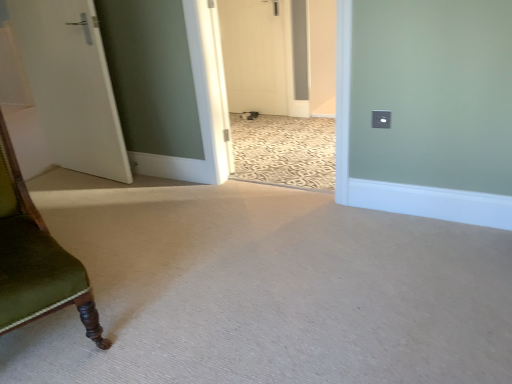
Question: Which direction should I rotate to look at white matte door at center, the 1th door from the right?

Choices:
 (A) left
 (B) right

Answer: (A)

Question: Is green velvet chair at left smaller than white matte door at left, which appears as the 1th door when viewed from the left?

Choices:
 (A) no
 (B) yes

Answer: (A)

Question: From a real-world perspective, does green velvet chair at left stand above white matte door at left, which is the second door from back to front?

Choices:
 (A) yes
 (B) no

Answer: (B)

Question: Considering the relative sizes of green velvet chair at left and white matte door at left, which is counted as the 1th door, starting from the front, in the image provided, is green velvet chair at left shorter than white matte door at left, which is counted as the 1th door, starting from the front,?

Choices:
 (A) yes
 (B) no

Answer: (A)

Question: Can you confirm if green velvet chair at left is positioned to the right of white matte door at left, which appears as the 1th door when viewed from the left?

Choices:
 (A) no
 (B) yes

Answer: (B)

Question: From the image's perspective, does green velvet chair at left appear lower than white matte door at left, which appears as the 1th door when viewed from the left?

Choices:
 (A) yes
 (B) no

Answer: (A)

Question: Considering the relative sizes of green velvet chair at left and white matte door at left, the second door viewed from the right, in the image provided, is green velvet chair at left wider than white matte door at left, the second door viewed from the right,?

Choices:
 (A) no
 (B) yes

Answer: (B)

Question: Is green velvet chair at left oriented towards white matte door at center, which ranks as the first door in back-to-front order?

Choices:
 (A) no
 (B) yes

Answer: (A)

Question: From the image's perspective, does green velvet chair at left appear lower than white matte door at center, the second door when ordered from front to back?

Choices:
 (A) no
 (B) yes

Answer: (B)

Question: Is white matte door at center, the 1th door from the right, completely or partially inside green velvet chair at left?

Choices:
 (A) no
 (B) yes

Answer: (A)

Question: Is green velvet chair at left taller than white matte door at center, which is the second door from left to right?

Choices:
 (A) no
 (B) yes

Answer: (A)

Question: Are green velvet chair at left and white matte door at center, the second door when ordered from front to back, beside each other?

Choices:
 (A) yes
 (B) no

Answer: (B)

Question: Is green velvet chair at left completely or partially outside of white matte door at center, the second door when ordered from front to back?

Choices:
 (A) no
 (B) yes

Answer: (B)

Question: Considering the relative sizes of white matte door at left, which appears as the 1th door when viewed from the left, and white matte door at center, which is the second door from left to right, in the image provided, is white matte door at left, which appears as the 1th door when viewed from the left, wider than white matte door at center, which is the second door from left to right,?

Choices:
 (A) yes
 (B) no

Answer: (A)